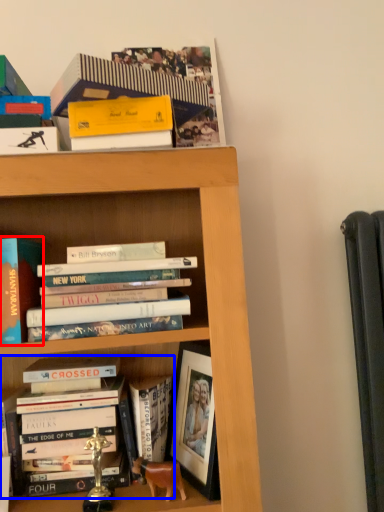
Question: Which object appears closest to the camera in this image, book (highlighted by a red box) or book (highlighted by a blue box)?

Choices:
 (A) book
 (B) book

Answer: (A)